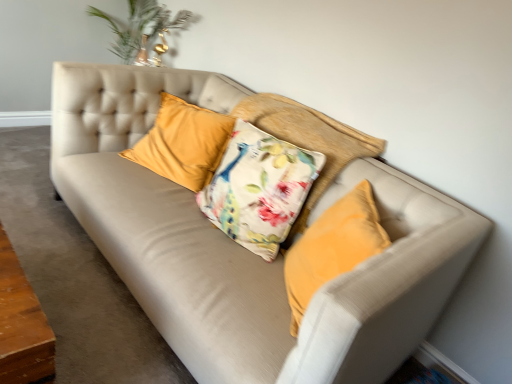
This screenshot has width=512, height=384. I want to click on suede beige couch at center, so click(244, 249).

The image size is (512, 384). What do you see at coordinates (184, 143) in the screenshot? I see `velvet yellow pillow at center, the first pillow positioned from the left` at bounding box center [184, 143].

Measure the distance between point (196, 117) and camera.

Point (196, 117) is 7.50 feet away from camera.

Locate an element on the screen. The width and height of the screenshot is (512, 384). floral fabric cushion at center, the 1th pillow from the right is located at coordinates (308, 141).

At what (x,y) coordinates should I click in order to perform the action: click on suede beige couch at center. Please return your answer as a coordinate pair (x, y). The image size is (512, 384). Looking at the image, I should click on (244, 249).

Does floral fabric cushion at center, the 1th pillow from the right, lie in front of suede beige couch at center?

Answer: No, floral fabric cushion at center, the 1th pillow from the right, is behind suede beige couch at center.

Is floral fabric cushion at center, the 2th pillow in the left-to-right sequence, smaller than suede beige couch at center?

Actually, floral fabric cushion at center, the 2th pillow in the left-to-right sequence, might be larger than suede beige couch at center.

From a real-world perspective, which object rests below the other?

In real-world perspective, suede beige couch at center is lower.

Is floral fabric cushion at center, the 1th pillow from the right, inside the boundaries of suede beige couch at center, or outside?

floral fabric cushion at center, the 1th pillow from the right, exists outside the volume of suede beige couch at center.

From the image's perspective, is velvet yellow pillow at center, the first pillow positioned from the left, positioned above or below floral fabric cushion at center, the 1th pillow from the right?

From the image's perspective, velvet yellow pillow at center, the first pillow positioned from the left, appears above floral fabric cushion at center, the 1th pillow from the right.

How different are the orientations of velvet yellow pillow at center, marked as the 2th pillow in a right-to-left arrangement, and floral fabric cushion at center, the 2th pillow in the left-to-right sequence, in degrees?

They differ by 14.2 degrees in their facing directions.

Locate an element on the screen. pillow above the floral fabric cushion at center, the 1th pillow from the right (from the image's perspective) is located at coordinates (184, 143).

Which object is wider, floral fabric cushion at center, the 2th pillow in the left-to-right sequence, or velvet yellow pillow at center, marked as the 2th pillow in a right-to-left arrangement?

Wider between the two is floral fabric cushion at center, the 2th pillow in the left-to-right sequence.

From a real-world perspective, which is physically above, floral fabric cushion at center, the 1th pillow from the right, or velvet yellow pillow at center, the first pillow positioned from the left?

floral fabric cushion at center, the 1th pillow from the right, from a real-world perspective.

In the image, is floral fabric cushion at center, the 1th pillow from the right, on the left side or the right side of velvet yellow pillow at center, marked as the 2th pillow in a right-to-left arrangement?

From the image, it's evident that floral fabric cushion at center, the 1th pillow from the right, is to the right of velvet yellow pillow at center, marked as the 2th pillow in a right-to-left arrangement.

Looking at the image, does floral fabric cushion at center, the 1th pillow from the right, seem bigger or smaller compared to velvet yellow pillow at center, the first pillow positioned from the left?

Considering their sizes, floral fabric cushion at center, the 1th pillow from the right, takes up more space than velvet yellow pillow at center, the first pillow positioned from the left.

Which point is more forward, (234,364) or (188,145)?

The point (234,364) is in front.

The image size is (512, 384). Find the location of `the 1st pillow counting from the right of the suede beige couch at center`. the 1st pillow counting from the right of the suede beige couch at center is located at coordinates (184, 143).

Does suede beige couch at center turn towards velvet yellow pillow at center, the first pillow positioned from the left?

No, suede beige couch at center is not turned towards velvet yellow pillow at center, the first pillow positioned from the left.

Considering the relative sizes of suede beige couch at center and velvet yellow pillow at center, marked as the 2th pillow in a right-to-left arrangement, in the image provided, is suede beige couch at center smaller than velvet yellow pillow at center, marked as the 2th pillow in a right-to-left arrangement,?

No, suede beige couch at center is not smaller than velvet yellow pillow at center, marked as the 2th pillow in a right-to-left arrangement.

Is suede beige couch at center located within velvet yellow pillow at center, the first pillow positioned from the left?

No, suede beige couch at center is not a part of velvet yellow pillow at center, the first pillow positioned from the left.

Does velvet yellow pillow at center, the first pillow positioned from the left, have a lesser width compared to suede beige couch at center?

Correct, the width of velvet yellow pillow at center, the first pillow positioned from the left, is less than that of suede beige couch at center.

From a real-world perspective, which is physically above, velvet yellow pillow at center, the first pillow positioned from the left, or suede beige couch at center?

velvet yellow pillow at center, the first pillow positioned from the left, from a real-world perspective.

Which point is more distant from viewer, (185, 172) or (72, 88)?

The point (185, 172) is farther from the camera.

Would you say suede beige couch at center is a long distance from floral fabric cushion at center, the 2th pillow in the left-to-right sequence?

No, suede beige couch at center is in close proximity to floral fabric cushion at center, the 2th pillow in the left-to-right sequence.

From a real-world perspective, is suede beige couch at center physically located above or below floral fabric cushion at center, the 1th pillow from the right?

Clearly, from a real-world perspective, suede beige couch at center is below floral fabric cushion at center, the 1th pillow from the right.

The height and width of the screenshot is (384, 512). Find the location of `studio couch below the floral fabric cushion at center, the 2th pillow in the left-to-right sequence (from a real-world perspective)`. studio couch below the floral fabric cushion at center, the 2th pillow in the left-to-right sequence (from a real-world perspective) is located at coordinates (244, 249).

Which object is thinner, suede beige couch at center or floral fabric cushion at center, the 1th pillow from the right?

With smaller width is floral fabric cushion at center, the 1th pillow from the right.

What are the coordinates of `studio couch below the floral fabric cushion at center, the 2th pillow in the left-to-right sequence (from the image's perspective)` in the screenshot? It's located at (244, 249).

Locate an element on the screen. Image resolution: width=512 pixels, height=384 pixels. pillow below the floral fabric cushion at center, the 2th pillow in the left-to-right sequence (from a real-world perspective) is located at coordinates (184, 143).

Which object lies further to the anchor point floral fabric cushion at center, the 1th pillow from the right, suede beige couch at center or velvet yellow pillow at center, the first pillow positioned from the left?

suede beige couch at center is positioned further to the anchor floral fabric cushion at center, the 1th pillow from the right.

Which object lies nearer to the anchor point suede beige couch at center, floral fabric cushion at center, the 2th pillow in the left-to-right sequence, or velvet yellow pillow at center, marked as the 2th pillow in a right-to-left arrangement?

velvet yellow pillow at center, marked as the 2th pillow in a right-to-left arrangement.

Which object lies further to the anchor point velvet yellow pillow at center, marked as the 2th pillow in a right-to-left arrangement, floral fabric cushion at center, the 1th pillow from the right, or suede beige couch at center?

The object further to velvet yellow pillow at center, marked as the 2th pillow in a right-to-left arrangement, is suede beige couch at center.

Considering their positions, is velvet yellow pillow at center, marked as the 2th pillow in a right-to-left arrangement, positioned closer to floral fabric cushion at center, the 2th pillow in the left-to-right sequence, than suede beige couch at center?

The object closer to floral fabric cushion at center, the 2th pillow in the left-to-right sequence, is velvet yellow pillow at center, marked as the 2th pillow in a right-to-left arrangement.

In the scene shown: Based on their spatial positions, is suede beige couch at center or floral fabric cushion at center, the 1th pillow from the right, closer to velvet yellow pillow at center, marked as the 2th pillow in a right-to-left arrangement?

Based on the image, floral fabric cushion at center, the 1th pillow from the right, appears to be nearer to velvet yellow pillow at center, marked as the 2th pillow in a right-to-left arrangement.

From the picture: Which object lies further to the anchor point suede beige couch at center, velvet yellow pillow at center, the first pillow positioned from the left, or floral fabric cushion at center, the 2th pillow in the left-to-right sequence?

floral fabric cushion at center, the 2th pillow in the left-to-right sequence, is positioned further to the anchor suede beige couch at center.

What are the coordinates of `pillow between suede beige couch at center and velvet yellow pillow at center, marked as the 2th pillow in a right-to-left arrangement, along the z-axis` in the screenshot? It's located at click(x=308, y=141).